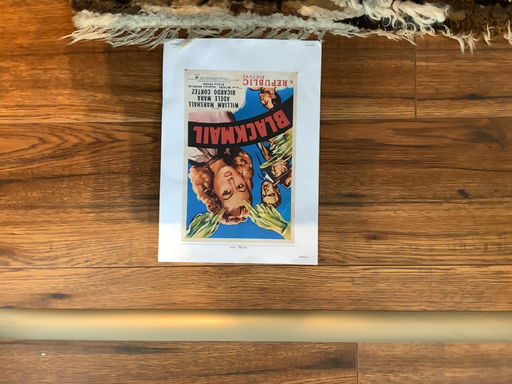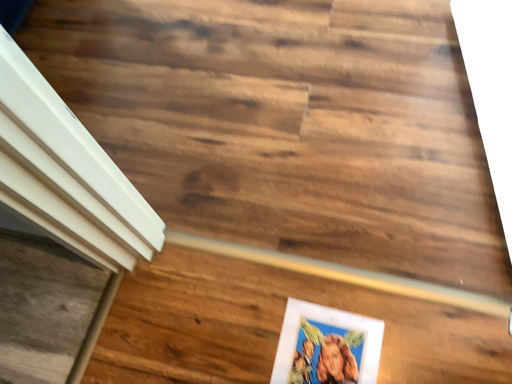
Question: Which way did the camera rotate in the video?

Choices:
 (A) rotated upward
 (B) rotated downward

Answer: (A)